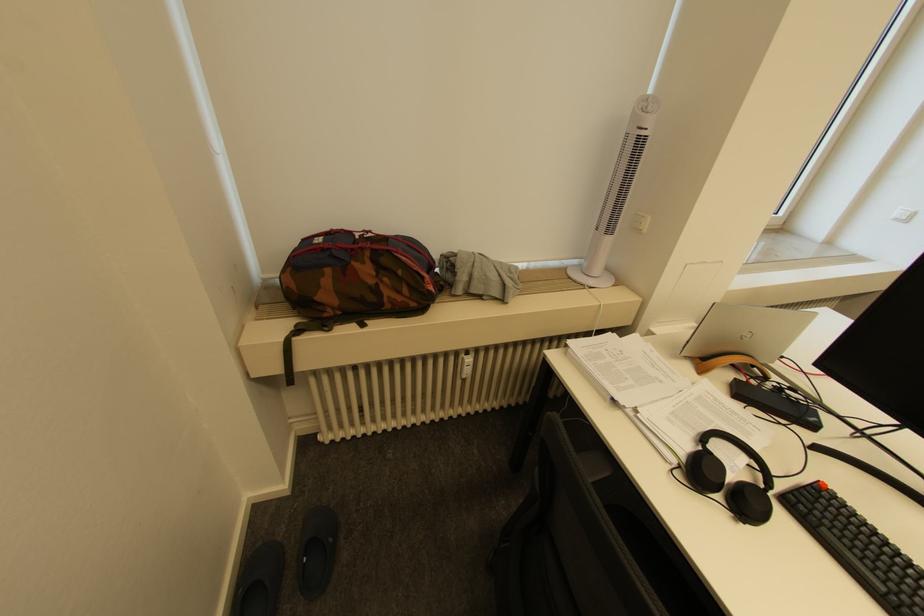
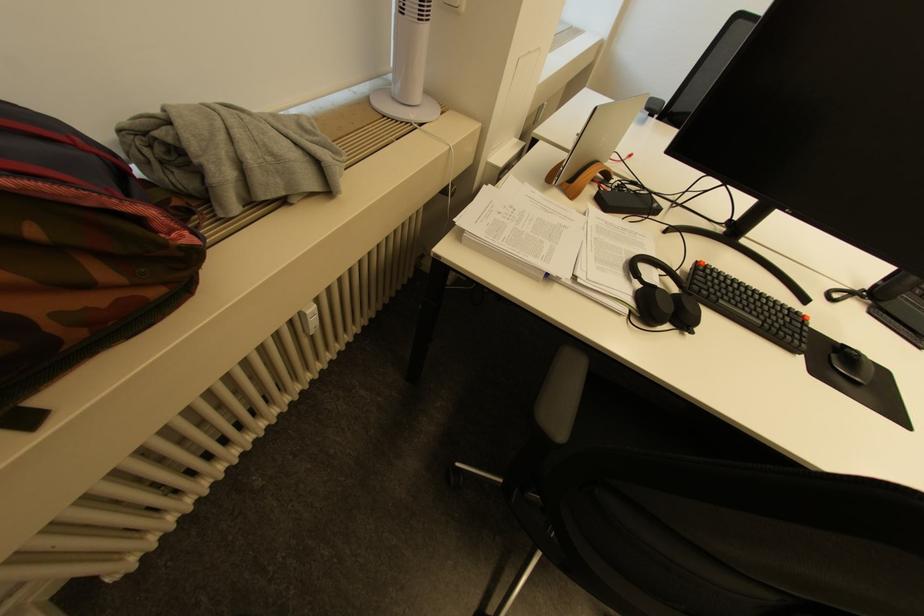
The point at (576, 278) is marked in the first image. Where is the corresponding point in the second image?

(391, 116)